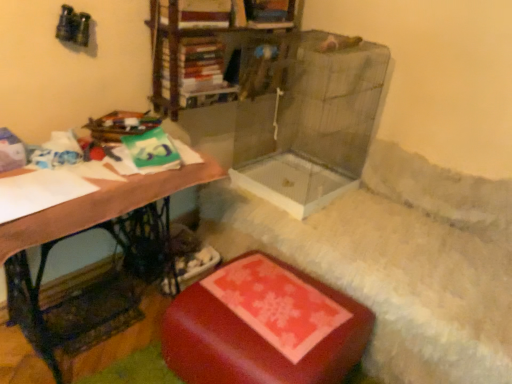
Question: From a real-world perspective, does metallic bookshelf at upper center stand above rubberized red ottoman at lower center?

Choices:
 (A) yes
 (B) no

Answer: (A)

Question: From the image's perspective, is metallic bookshelf at upper center located beneath rubberized red ottoman at lower center?

Choices:
 (A) yes
 (B) no

Answer: (B)

Question: Is metallic bookshelf at upper center facing away from rubberized red ottoman at lower center?

Choices:
 (A) yes
 (B) no

Answer: (B)

Question: Does metallic bookshelf at upper center have a lesser width compared to rubberized red ottoman at lower center?

Choices:
 (A) no
 (B) yes

Answer: (B)

Question: Would you consider metallic bookshelf at upper center to be distant from rubberized red ottoman at lower center?

Choices:
 (A) no
 (B) yes

Answer: (A)

Question: From a real-world perspective, is metallic bookshelf at upper center positioned under rubberized red ottoman at lower center based on gravity?

Choices:
 (A) yes
 (B) no

Answer: (B)

Question: Does rubberized red ottoman at lower center appear on the right side of hardcover book at upper center?

Choices:
 (A) yes
 (B) no

Answer: (A)

Question: Is rubberized red ottoman at lower center outside hardcover book at upper center?

Choices:
 (A) no
 (B) yes

Answer: (B)

Question: Is rubberized red ottoman at lower center smaller than hardcover book at upper center?

Choices:
 (A) no
 (B) yes

Answer: (A)

Question: Does rubberized red ottoman at lower center have a larger size compared to hardcover book at upper center?

Choices:
 (A) no
 (B) yes

Answer: (B)

Question: Does rubberized red ottoman at lower center have a greater height compared to hardcover book at upper center?

Choices:
 (A) no
 (B) yes

Answer: (B)

Question: Can you confirm if rubberized red ottoman at lower center is thinner than hardcover book at upper center?

Choices:
 (A) no
 (B) yes

Answer: (A)

Question: Is rubberized red ottoman at lower center wider than wooden desk at left?

Choices:
 (A) yes
 (B) no

Answer: (A)